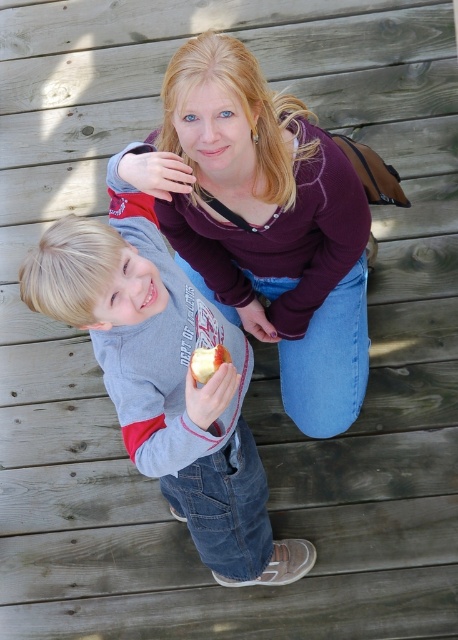
Consider the image. You are standing at the point labeled point (196, 364) on the wooden deck. If you want to move to the point labeled point (201, 531), which direction should you walk relative to the deck?

You should walk backward because point (201, 531) is behind point (196, 364).

You are a photographer taking a picture of the two people on the wooden deck. You need to ensure that both the purple sweater at upper center and the matte gray shirt at center are visible in the frame. Based on their positions, which object is closer to the right edge of the photo?

The purple sweater at upper center is positioned to the right of the matte gray shirt at center, so it is closer to the right edge of the photo.